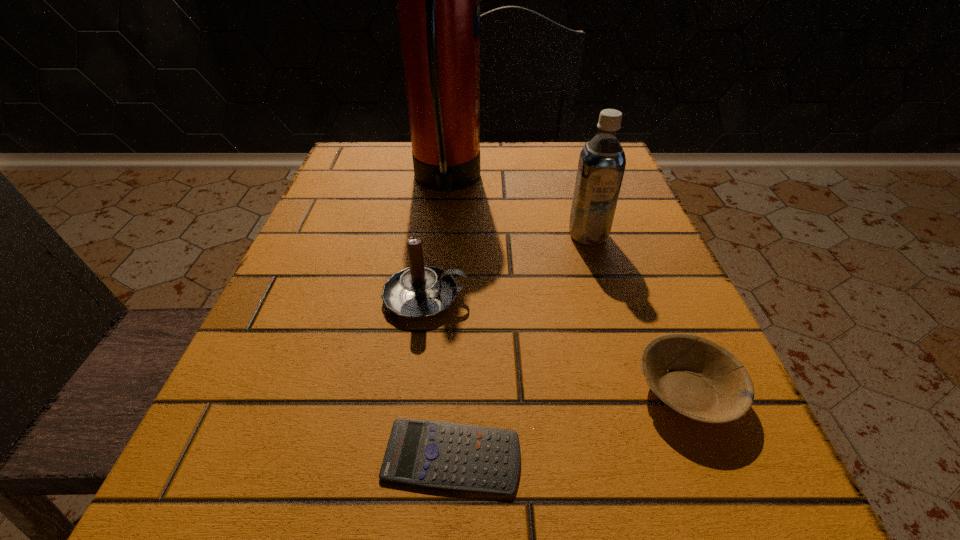
I want to click on fire extinguisher, so click(x=438, y=0).

Identify the location of the tallest object. The image size is (960, 540). (438, 0).

Where is `soya milk`? The width and height of the screenshot is (960, 540). soya milk is located at coordinates (602, 161).

Locate an element on the screen. This screenshot has width=960, height=540. the second farthest object is located at coordinates (602, 161).

Find the location of a particular element. The width and height of the screenshot is (960, 540). the third farthest object is located at coordinates (417, 292).

Locate an element on the screen. candle is located at coordinates (417, 292).

Locate an element on the screen. The image size is (960, 540). bowl is located at coordinates (705, 382).

I want to click on calculator, so click(441, 455).

Locate an element on the screen. The height and width of the screenshot is (540, 960). vacant space located 0.250m on the surface of the tallest object is located at coordinates (595, 182).

The image size is (960, 540). I want to click on vacant space positioned on the label of the fourth shortest object, so click(x=636, y=396).